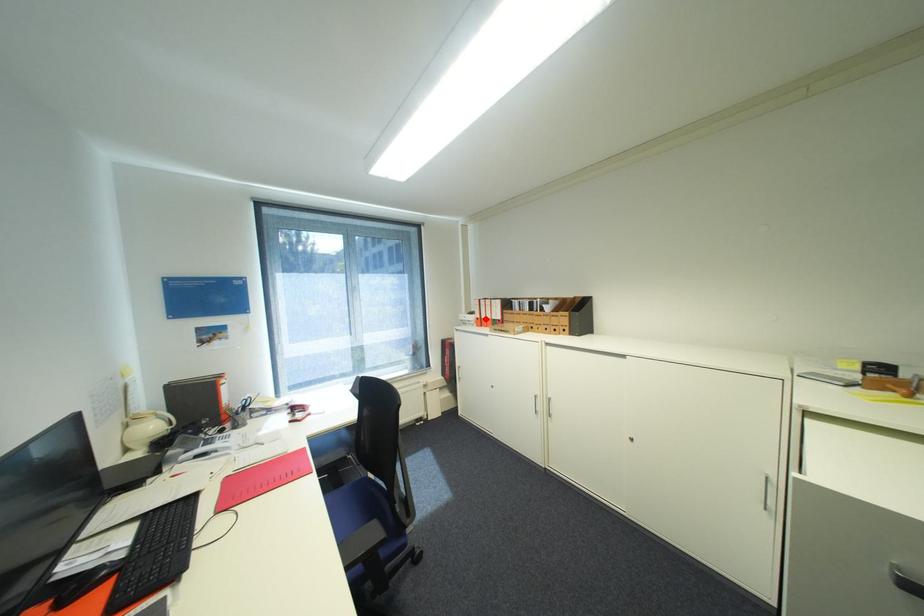
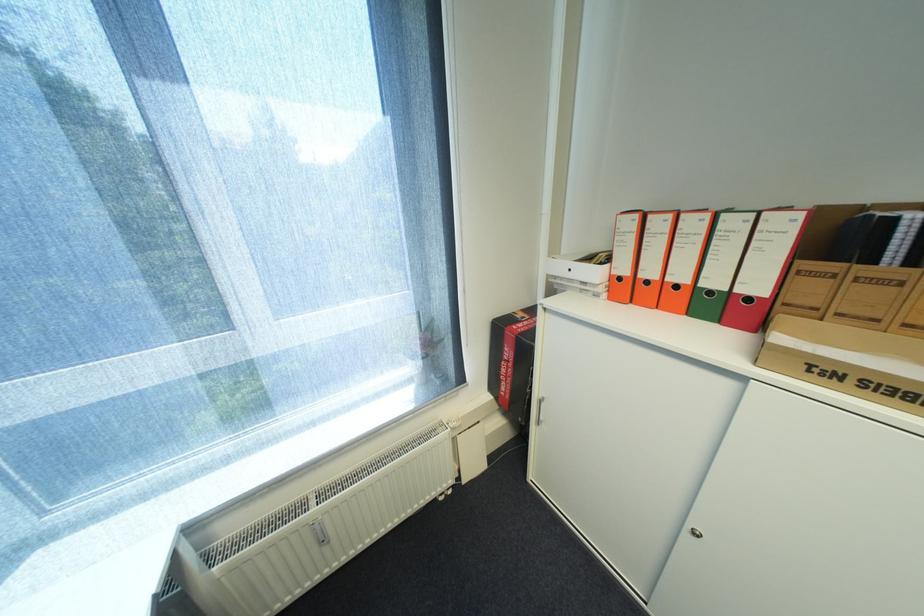
Question: I am providing you with two images of the same scene from different viewpoints. A red point is marked on the first image. Can you still see the location of the red point in image 2?

Choices:
 (A) Yes
 (B) No

Answer: (A)